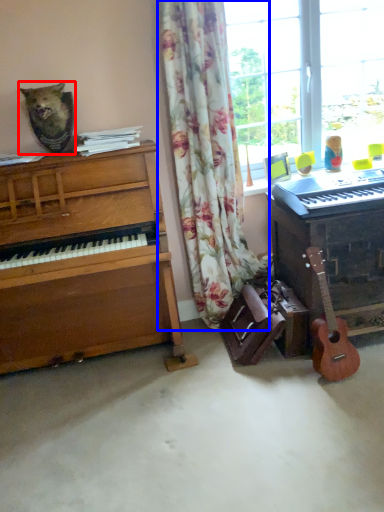
Question: Which point is closer to the camera, animal (highlighted by a red box) or curtain (highlighted by a blue box)?

Choices:
 (A) animal
 (B) curtain

Answer: (B)